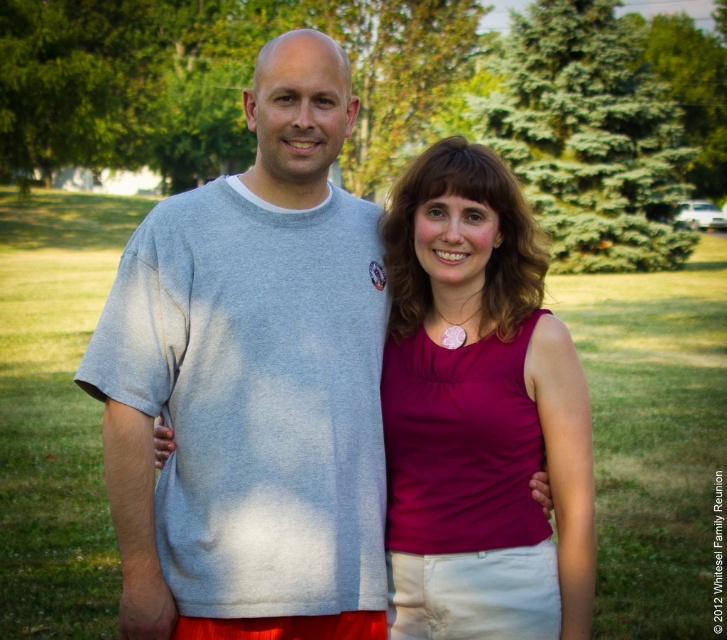
Does gray heathered t-shirt at center have a smaller size compared to matte pink fabric at center?

No.

Is gray heathered t-shirt at center bigger than matte pink fabric at center?

Yes, gray heathered t-shirt at center is bigger than matte pink fabric at center.

Who is more forward, (192,621) or (569,490)?

Point (192,621) is in front.

Locate an element on the screen. Image resolution: width=727 pixels, height=640 pixels. gray heathered t-shirt at center is located at coordinates (252, 381).

At what (x,y) coordinates should I click in order to perform the action: click on green grass at center. Please return your answer as a coordinate pair (x, y). Looking at the image, I should click on (654, 436).

Is green grass at center above green leafy tree at upper right?

No.

Between point (7, 355) and point (643, 140), which one is positioned in front?

Point (7, 355) is more forward.

Where is `green grass at center`? The image size is (727, 640). green grass at center is located at coordinates (654, 436).

Between green leafy tree at upper right and green leafy tree at upper center, which one is positioned higher?

green leafy tree at upper center is above.

Locate an element on the screen. green leafy tree at upper right is located at coordinates point(590,138).

Image resolution: width=727 pixels, height=640 pixels. What are the coordinates of `green leafy tree at upper right` in the screenshot? It's located at (590, 138).